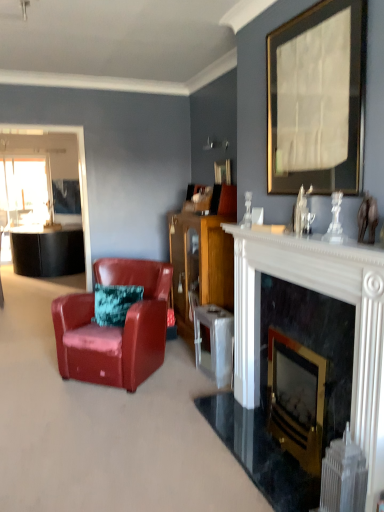
The height and width of the screenshot is (512, 384). Find the location of `vacant space situated on the left part of metallic silver table at center`. vacant space situated on the left part of metallic silver table at center is located at coordinates (180, 376).